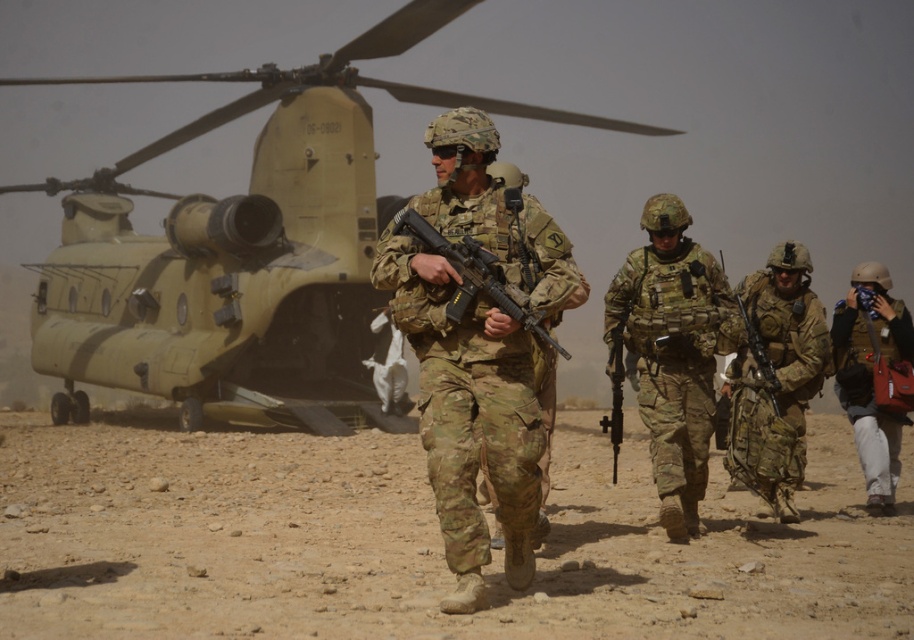
You are a drone operator observing the desert scene. You need to identify the exact location of the camouflage uniform at center relative to the Chinook helicopter. Can you determine if it is positioned to the left or right of the helicopter?

The camouflage uniform at center is located at point 0.647 on the x and 0.514 on the y. The Chinook helicopter is parked in the background, so the camouflage uniform at center is to the right of the Chinook helicopter.

You are a photographer trying to capture a clear image of the camouflage uniform at center and the matte black rifle at center. Which object should you zoom in on to ensure it fills the frame without cropping?

The camouflage uniform at center is wider than the matte black rifle at center, so you should zoom in on the camouflage uniform at center to ensure it fills the frame without cropping.